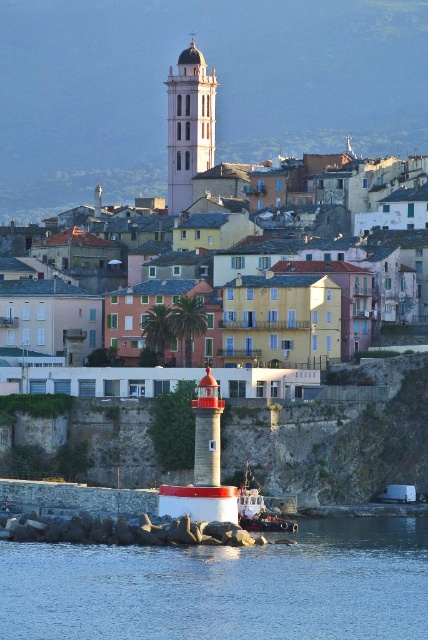
Question: Which of the following is the closest to the observer?

Choices:
 (A) matte pink building at upper center
 (B) white plastic boat at lower center
 (C) smooth white tower at center

Answer: (B)

Question: Which object is closer to the camera taking this photo?

Choices:
 (A) clear water at center
 (B) matte pink building at upper center
 (C) white plastic boat at lower center
 (D) smooth white tower at center

Answer: (A)

Question: Is clear water at center closer to camera compared to matte pink building at upper center?

Choices:
 (A) yes
 (B) no

Answer: (A)

Question: Which point is farther to the camera?

Choices:
 (A) (168, 84)
 (B) (140, 308)

Answer: (A)

Question: Is matte pink building at upper center to the left of white plastic boat at lower center from the viewer's perspective?

Choices:
 (A) no
 (B) yes

Answer: (B)

Question: Is the position of matte pink building at upper center more distant than that of white plastic boat at lower center?

Choices:
 (A) yes
 (B) no

Answer: (A)